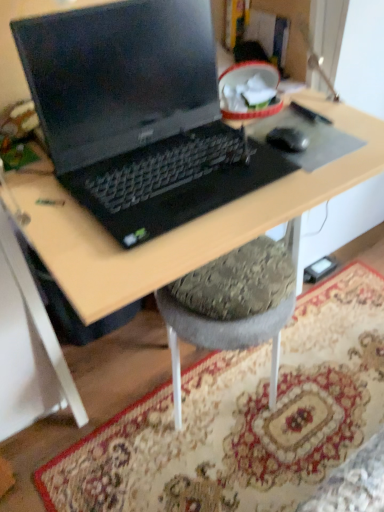
Question: Is carpeted rug at lower center closer to camera compared to black rubber mouse at right?

Choices:
 (A) yes
 (B) no

Answer: (A)

Question: Can you confirm if carpeted rug at lower center is taller than black rubber mouse at right?

Choices:
 (A) yes
 (B) no

Answer: (B)

Question: From the image's perspective, is carpeted rug at lower center located above black rubber mouse at right?

Choices:
 (A) no
 (B) yes

Answer: (A)

Question: From a real-world perspective, does carpeted rug at lower center sit lower than black rubber mouse at right?

Choices:
 (A) no
 (B) yes

Answer: (B)

Question: Does carpeted rug at lower center have a lesser width compared to black rubber mouse at right?

Choices:
 (A) no
 (B) yes

Answer: (A)

Question: Considering the relative sizes of carpeted rug at lower center and black rubber mouse at right in the image provided, is carpeted rug at lower center shorter than black rubber mouse at right?

Choices:
 (A) yes
 (B) no

Answer: (A)

Question: Is black rubber mouse at right positioned behind black plastic desk at center?

Choices:
 (A) yes
 (B) no

Answer: (A)

Question: Is black rubber mouse at right at the right side of black plastic desk at center?

Choices:
 (A) no
 (B) yes

Answer: (B)

Question: Is black rubber mouse at right not near black plastic desk at center?

Choices:
 (A) no
 (B) yes

Answer: (A)

Question: Is black rubber mouse at right shorter than black plastic desk at center?

Choices:
 (A) no
 (B) yes

Answer: (B)

Question: Considering the relative sizes of black rubber mouse at right and black plastic desk at center in the image provided, is black rubber mouse at right thinner than black plastic desk at center?

Choices:
 (A) yes
 (B) no

Answer: (A)

Question: From a real-world perspective, is black rubber mouse at right under black plastic desk at center?

Choices:
 (A) no
 (B) yes

Answer: (A)

Question: Is black plastic desk at center taller than black matte mousepad at center?

Choices:
 (A) yes
 (B) no

Answer: (A)